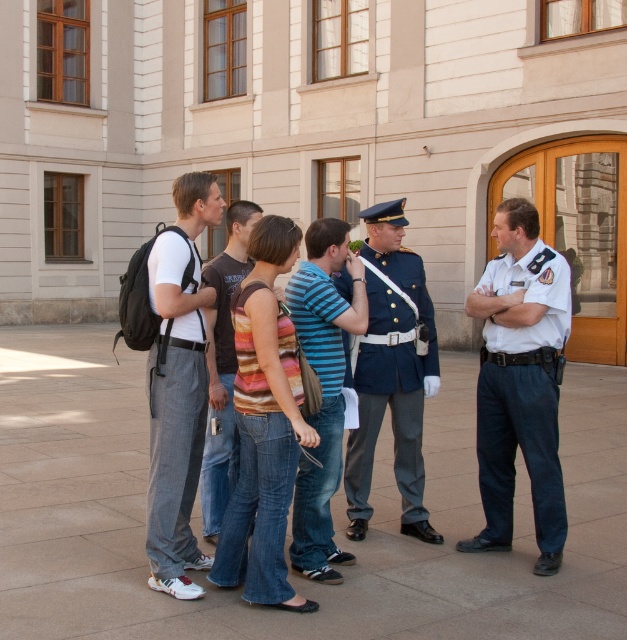
Question: Which object is farther from the camera taking this photo?

Choices:
 (A) white uniform at center
 (B) striped shirt at center
 (C) blue striped shirt at center

Answer: (A)

Question: Does blue uniform at center appear over blue striped shirt at center?

Choices:
 (A) no
 (B) yes

Answer: (B)

Question: Which point is farther to the camera?

Choices:
 (A) matte gray pants at left
 (B) striped fabric tank top at center

Answer: (A)

Question: Does blue uniform at center lie behind blue striped shirt at center?

Choices:
 (A) yes
 (B) no

Answer: (A)

Question: Which point appears farthest from the camera in this image?

Choices:
 (A) (429, 396)
 (B) (307, 490)
 (C) (251, 218)

Answer: (A)

Question: Can you confirm if striped fabric tank top at center is positioned to the right of striped shirt at center?

Choices:
 (A) yes
 (B) no

Answer: (A)